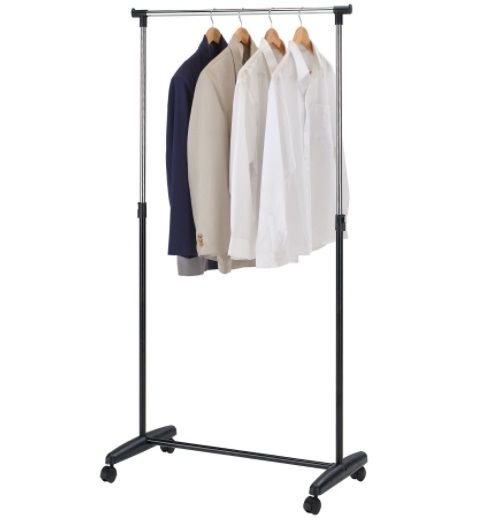
Identify the location of wooden part of hangers. (300, 30), (273, 35), (240, 34), (211, 35).